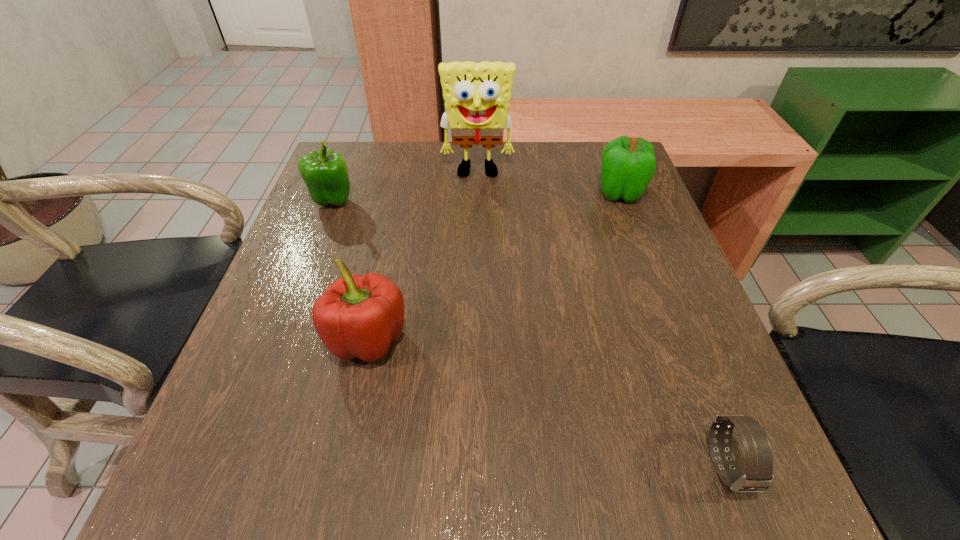
You are a GUI agent. You are given a task and a screenshot of the screen. Output one action in this format:
    pyautogui.click(x=<x>, y=<y>)
    Task: Click on the vacant space located 0.240m on the left of the rightmost bell pepper
    This screenshot has width=960, height=540.
    Given the screenshot: What is the action you would take?
    pyautogui.click(x=496, y=193)

Image resolution: width=960 pixels, height=540 pixels. I want to click on free spot located on the back of the second nearest object, so click(x=388, y=248).

Locate an element on the screen. sponge that is at the far edge is located at coordinates (477, 96).

The image size is (960, 540). Find the location of `object positioned at the near edge`. object positioned at the near edge is located at coordinates (758, 477).

At what (x,y) coordinates should I click in order to perform the action: click on bell pepper present at the right edge. Please return your answer as a coordinate pair (x, y). The height and width of the screenshot is (540, 960). Looking at the image, I should click on (628, 164).

The image size is (960, 540). What are the coordinates of `watch located in the right edge section of the desktop` in the screenshot? It's located at (758, 477).

The height and width of the screenshot is (540, 960). I want to click on object at the far left corner, so click(325, 173).

The height and width of the screenshot is (540, 960). Find the location of `object that is at the far right corner`. object that is at the far right corner is located at coordinates (628, 164).

Image resolution: width=960 pixels, height=540 pixels. I want to click on object that is at the near right corner, so click(758, 477).

The height and width of the screenshot is (540, 960). Find the location of `free point at the far edge`. free point at the far edge is located at coordinates (577, 188).